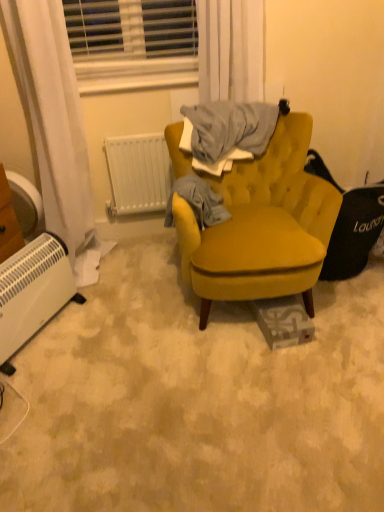
Question: Considering the relative positions of white plastic blinds at upper center and white sheer curtain at upper center in the image provided, is white plastic blinds at upper center to the left of white sheer curtain at upper center from the viewer's perspective?

Choices:
 (A) no
 (B) yes

Answer: (B)

Question: Is white plastic blinds at upper center closer to camera compared to white sheer curtain at upper center?

Choices:
 (A) yes
 (B) no

Answer: (B)

Question: Is white plastic blinds at upper center positioned with its back to white sheer curtain at upper center?

Choices:
 (A) yes
 (B) no

Answer: (B)

Question: From the image's perspective, would you say white plastic blinds at upper center is shown under white sheer curtain at upper center?

Choices:
 (A) yes
 (B) no

Answer: (B)

Question: Considering the relative sizes of white plastic blinds at upper center and white sheer curtain at upper center in the image provided, is white plastic blinds at upper center wider than white sheer curtain at upper center?

Choices:
 (A) yes
 (B) no

Answer: (A)

Question: Considering the relative sizes of white plastic blinds at upper center and white sheer curtain at upper center in the image provided, is white plastic blinds at upper center smaller than white sheer curtain at upper center?

Choices:
 (A) no
 (B) yes

Answer: (A)

Question: Does velvet mustard swivel chair at right have a greater width compared to white sheer curtain at upper center?

Choices:
 (A) no
 (B) yes

Answer: (B)

Question: Can white sheer curtain at upper center be found inside velvet mustard swivel chair at right?

Choices:
 (A) yes
 (B) no

Answer: (B)

Question: Is velvet mustard swivel chair at right smaller than white sheer curtain at upper center?

Choices:
 (A) yes
 (B) no

Answer: (B)

Question: From the image's perspective, is velvet mustard swivel chair at right below white sheer curtain at upper center?

Choices:
 (A) yes
 (B) no

Answer: (A)

Question: From a real-world perspective, is velvet mustard swivel chair at right beneath white sheer curtain at upper center?

Choices:
 (A) no
 (B) yes

Answer: (B)

Question: Can you confirm if velvet mustard swivel chair at right is taller than white sheer curtain at upper center?

Choices:
 (A) yes
 (B) no

Answer: (A)

Question: Is white plastic blinds at upper center to the right of white plastic radiator at lower left, positioned as the 1th radiator in left-to-right order, from the viewer's perspective?

Choices:
 (A) no
 (B) yes

Answer: (B)